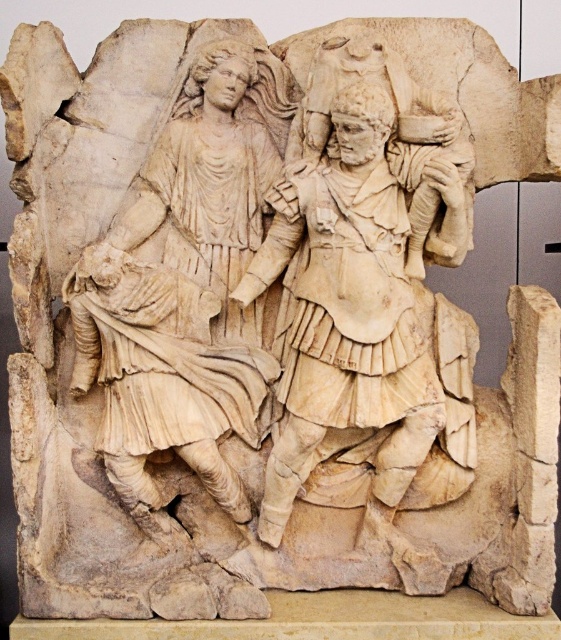
Question: Is white marble figure at center below white marble warrior at center?

Choices:
 (A) no
 (B) yes

Answer: (A)

Question: Does white marble figure at center have a greater width compared to white marble warrior at center?

Choices:
 (A) yes
 (B) no

Answer: (B)

Question: Is white marble figure at center behind white marble warrior at center?

Choices:
 (A) yes
 (B) no

Answer: (A)

Question: Among these points, which one is farthest from the camera?

Choices:
 (A) (282, 429)
 (B) (126, 365)

Answer: (A)